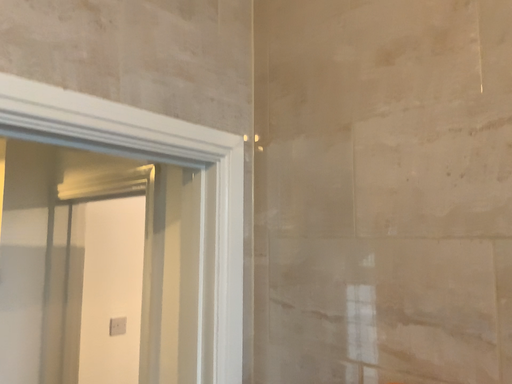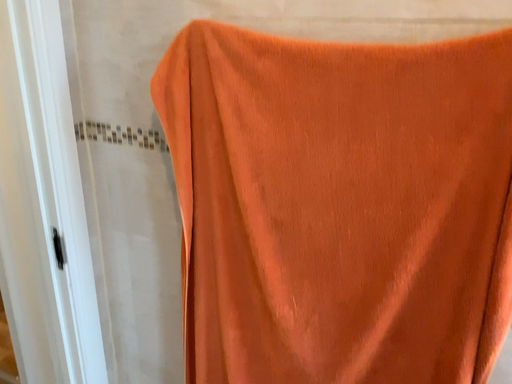
Question: How did the camera likely rotate when shooting the video?

Choices:
 (A) rotated right
 (B) rotated left

Answer: (A)